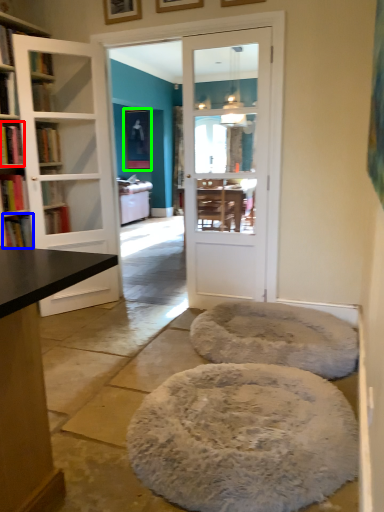
Question: Which object is positioned farthest from book (highlighted by a red box)? Select from book (highlighted by a blue box) and picture frame (highlighted by a green box).

Choices:
 (A) book
 (B) picture frame

Answer: (B)